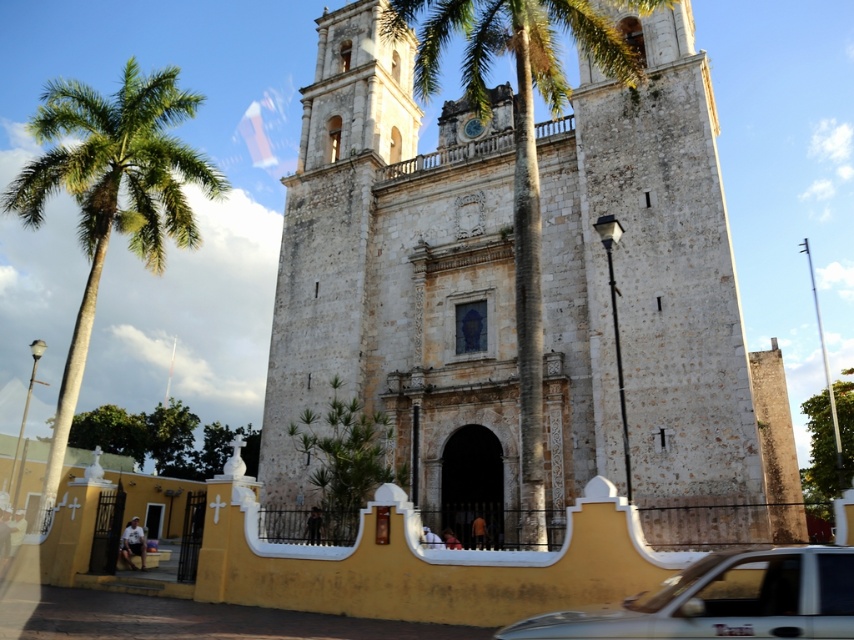
Question: Which is farther from the green leafy palm tree at left?

Choices:
 (A) white matte taxi at lower right
 (B) green leafy palm tree at center

Answer: (A)

Question: Is green leafy palm tree at center to the right of white matte taxi at lower right from the viewer's perspective?

Choices:
 (A) no
 (B) yes

Answer: (A)

Question: Which object is positioned farthest from the green leafy palm tree at center?

Choices:
 (A) white matte taxi at lower right
 (B) green leafy palm tree at left

Answer: (B)

Question: Which of these objects is positioned closest to the green leafy palm tree at center?

Choices:
 (A) white matte taxi at lower right
 (B) green leafy palm tree at left

Answer: (A)

Question: From the image, what is the correct spatial relationship of green leafy palm tree at left in relation to green leafy palm tree at center?

Choices:
 (A) right
 (B) left

Answer: (B)

Question: Is green leafy palm tree at left to the left of green leafy palm tree at center from the viewer's perspective?

Choices:
 (A) no
 (B) yes

Answer: (B)